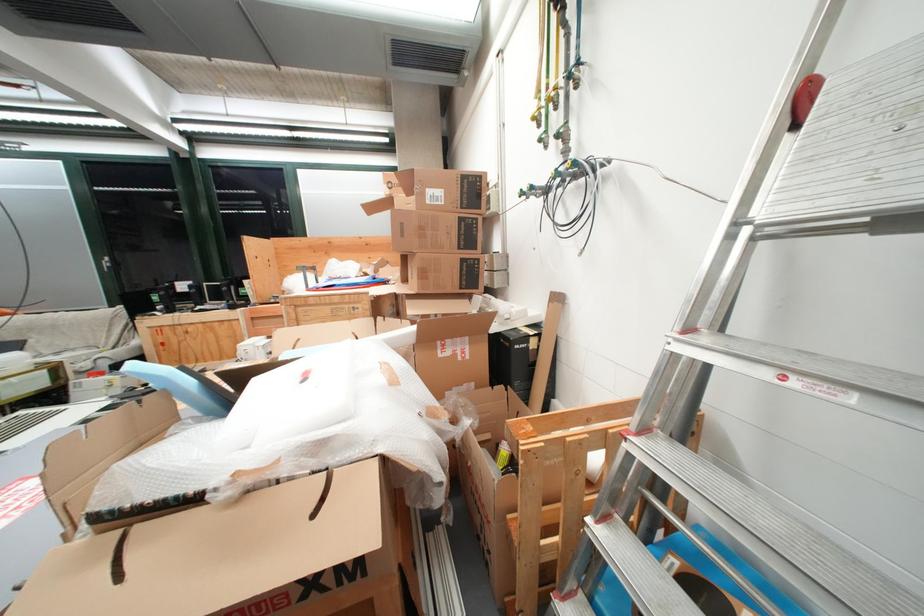
What do you see at coordinates (557, 184) in the screenshot? This screenshot has height=616, width=924. I see `the green valve handle` at bounding box center [557, 184].